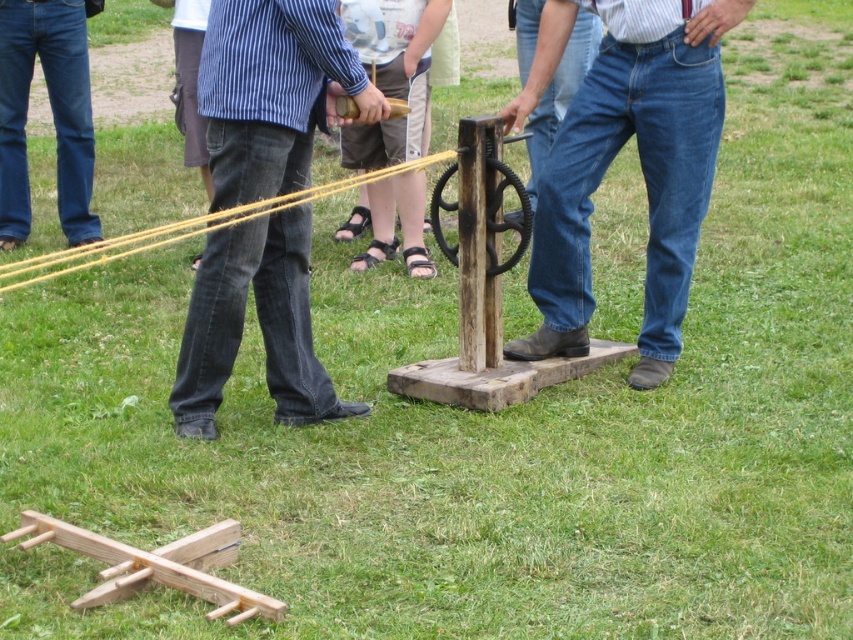
Can you confirm if denim jeans at left is positioned to the left of blue jeans at left?

No, denim jeans at left is not to the left of blue jeans at left.

Is denim jeans at left positioned at the back of blue jeans at left?

No, it is not.

Measure the distance between point (270, 298) and camera.

Point (270, 298) is 5.75 meters from camera.

Find the location of a particular element. Image resolution: width=853 pixels, height=640 pixels. denim jeans at left is located at coordinates (273, 92).

Is point (212, 323) in front of point (581, 182)?

Yes.

Does point (241, 314) come closer to viewer compared to point (676, 76)?

Yes, it is in front of point (676, 76).

Locate an element on the screen. denim jeans at left is located at coordinates (273, 92).

Who is more forward, (642, 150) or (62, 86)?

Point (642, 150)

Is blue jeans at center to the right of blue jeans at left from the viewer's perspective?

Yes, blue jeans at center is to the right of blue jeans at left.

Which is in front, point (685, 60) or point (13, 54)?

Positioned in front is point (685, 60).

Identify the location of blue jeans at center. The image size is (853, 640). (613, 157).